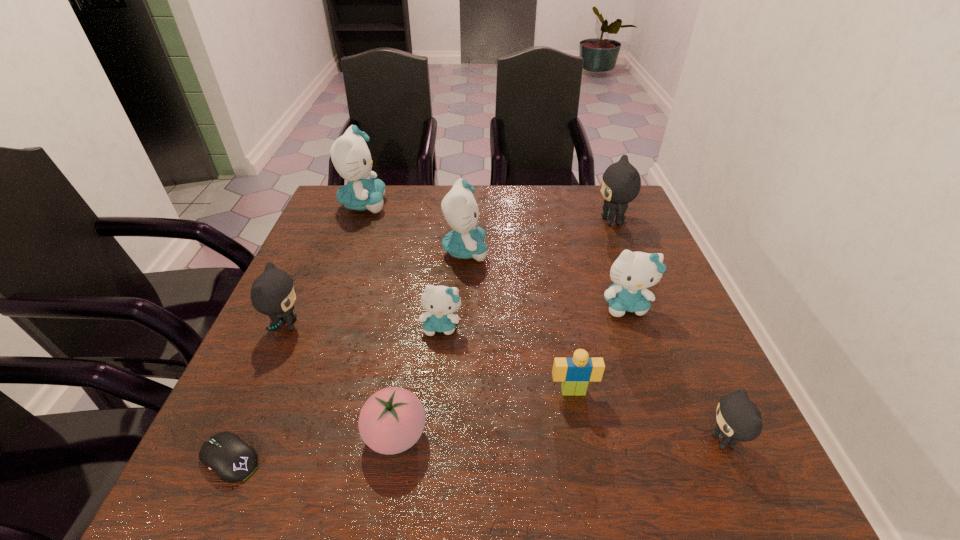
In order to click on the nearest kitten in this screenshot , I will do `click(738, 419)`.

You are a GUI agent. You are given a task and a screenshot of the screen. Output one action in this format:
    pyautogui.click(x=<x>, y=<y>)
    Task: Click on the smallest gray kitten
    The height and width of the screenshot is (540, 960).
    Given the screenshot: What is the action you would take?
    pyautogui.click(x=738, y=419)

Where is `tomato`? The height and width of the screenshot is (540, 960). tomato is located at coordinates (392, 420).

Locate an element on the screen. This screenshot has height=540, width=960. black computer equipment is located at coordinates (226, 454).

Find the location of `computer equipment`. computer equipment is located at coordinates coord(226,454).

Locate an element on the screen. The width and height of the screenshot is (960, 540). free space located 0.160m on the face of the tallest kitten is located at coordinates (440, 205).

Where is `blank space located on the face of the second biggest blue kitten`? The width and height of the screenshot is (960, 540). blank space located on the face of the second biggest blue kitten is located at coordinates (570, 251).

What are the coordinates of `free region located on the front-facing side of the biggest gray kitten` in the screenshot? It's located at (492, 221).

You are a GUI agent. You are given a task and a screenshot of the screen. Output one action in this format:
    pyautogui.click(x=<x>, y=<y>)
    Task: Click on the free space located on the front-facing side of the biggest gray kitten
    
    Given the screenshot: What is the action you would take?
    pyautogui.click(x=550, y=221)

This screenshot has width=960, height=540. Identify the location of vacant space located 0.060m on the front-facing side of the biggest gray kitten. (574, 221).